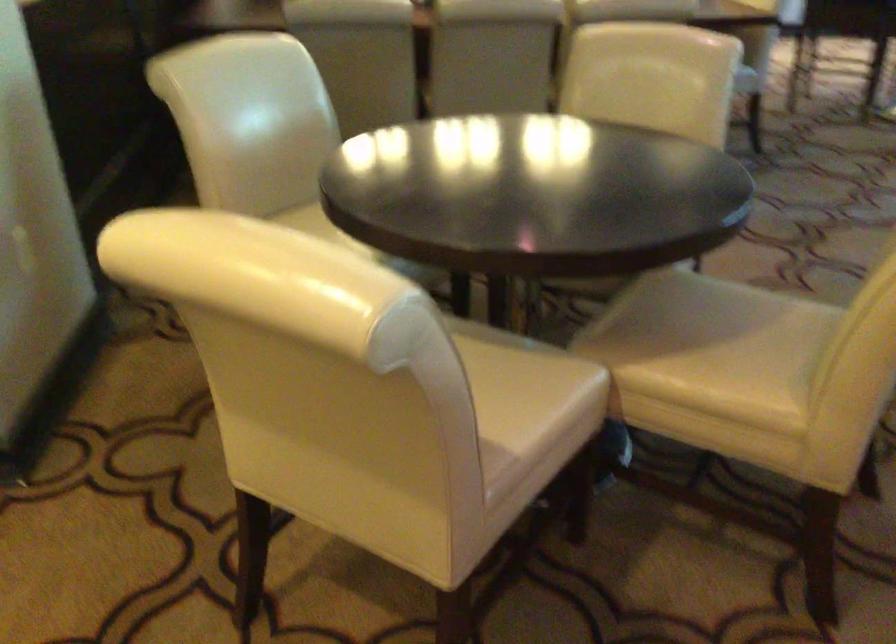
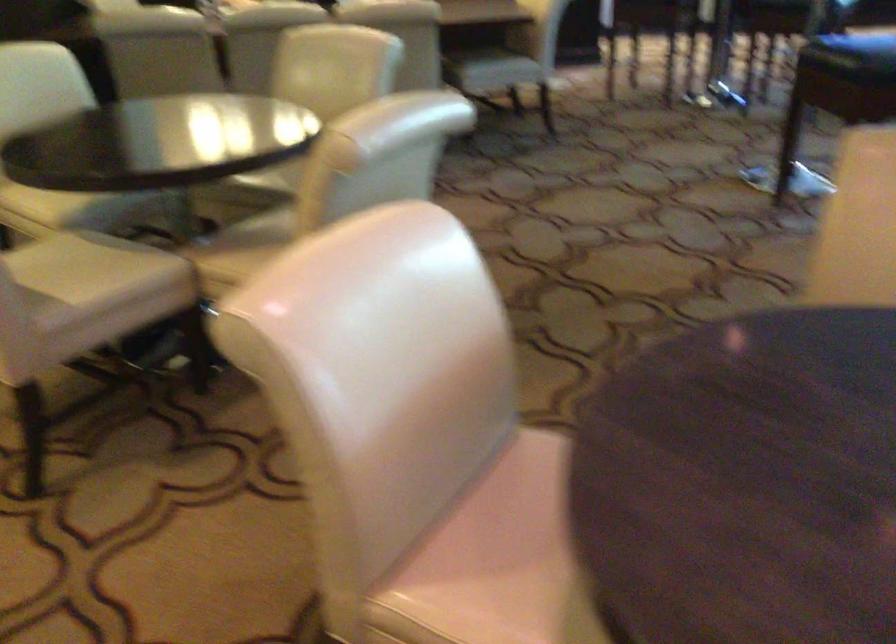
Find the pixel in the second image that matches [673,323] in the first image.

(259, 234)